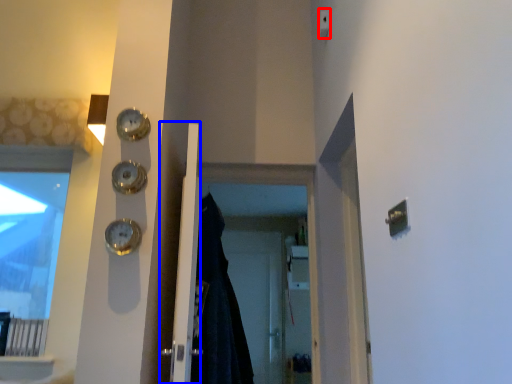
Question: Which object appears closest to the camera in this image, light switch (highlighted by a red box) or door (highlighted by a blue box)?

Choices:
 (A) light switch
 (B) door

Answer: (B)